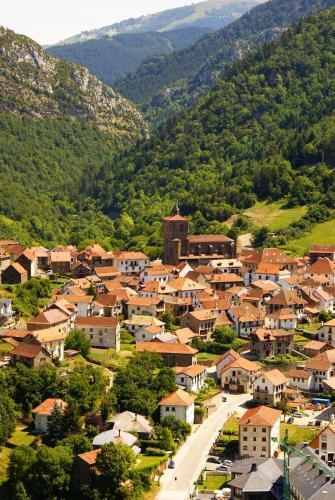
I want to click on window, so click(x=244, y=429).